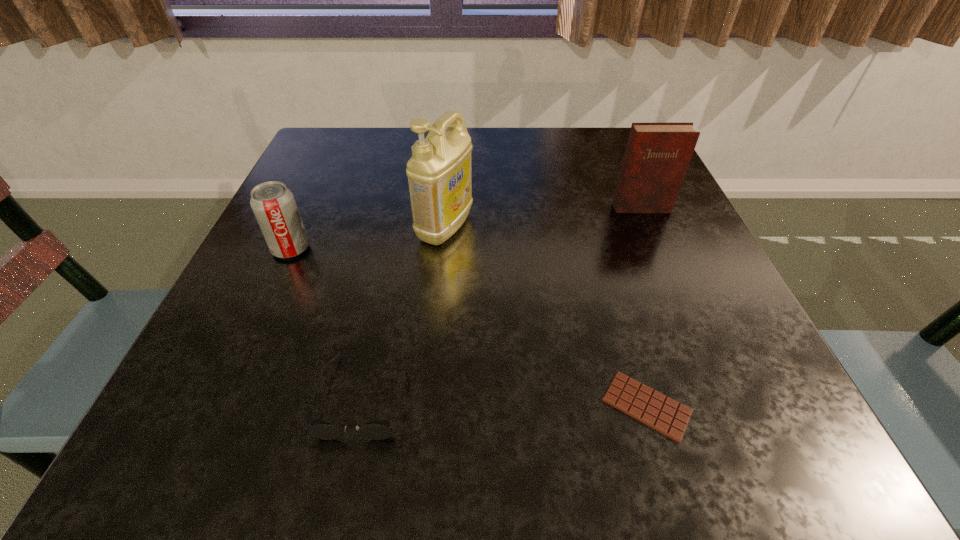
Image resolution: width=960 pixels, height=540 pixels. In order to click on free space between the tallest object and the sunglasses in this screenshot , I will do `click(404, 311)`.

You are a GUI agent. You are given a task and a screenshot of the screen. Output one action in this format:
    pyautogui.click(x=<x>, y=<y>)
    Task: Click on the free space between the sunglasses and the detergent
    
    Given the screenshot: What is the action you would take?
    pyautogui.click(x=404, y=311)

Locate an element on the screen. vacant space that's between the sunglasses and the detergent is located at coordinates (404, 311).

Locate an element on the screen. This screenshot has height=540, width=960. free area in between the diary and the candy bar is located at coordinates (643, 307).

Find the location of a particular element. object that is the second closest one to the detergent is located at coordinates (380, 429).

Identify which object is the second nearest to the shortest object. Please provide its 2D coordinates. Your answer should be formatted as a tuple, i.e. [(x, y)], where the tuple contains the x and y coordinates of a point satisfying the conditions above.

[(439, 172)]

At what (x,y) coordinates should I click in order to perform the action: click on vacant space that satisfies the following two spatial constraints: 1. on the front side of the third shortest object; 2. on the left side of the shortest object. Please return your answer as a coordinate pair (x, y). Looking at the image, I should click on (219, 406).